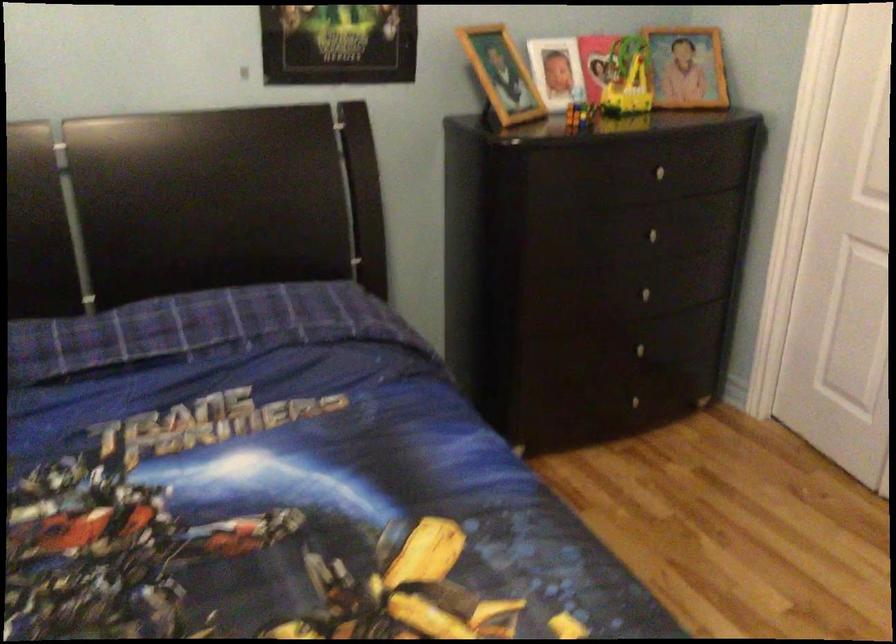
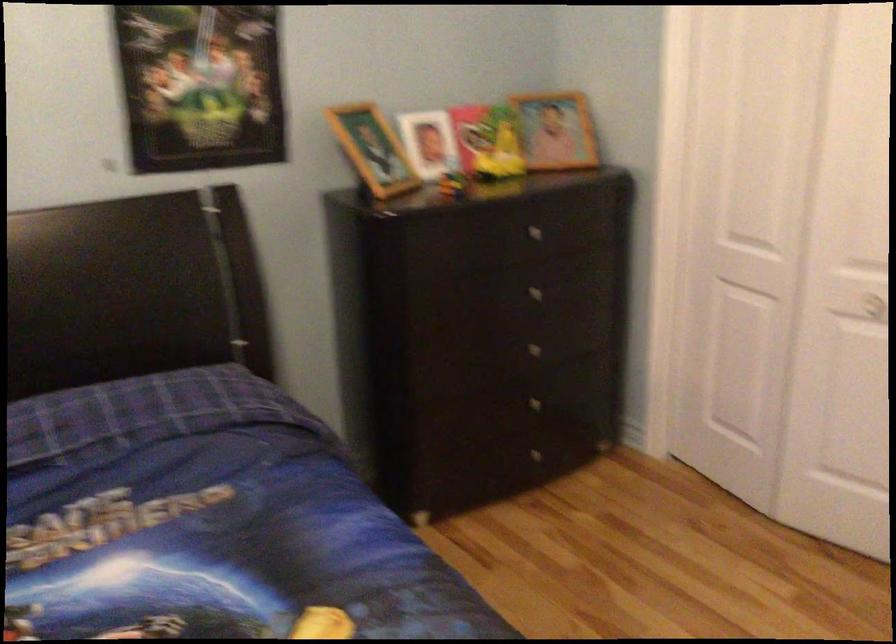
Locate, in the second image, the point that corresponds to point 655,169 in the first image.

(530, 230)